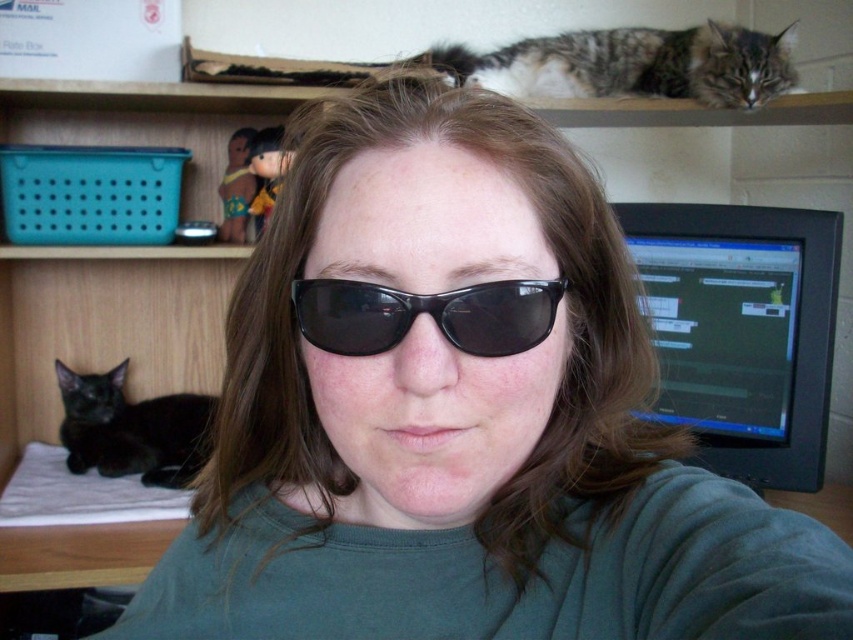
Can you confirm if black plastic sunglasses at center is smaller than black fur cat at lower left?

Indeed, black plastic sunglasses at center has a smaller size compared to black fur cat at lower left.

Who is more distant from viewer, (543, 312) or (67, 448)?

The point (67, 448) is more distant.

You are a GUI agent. You are given a task and a screenshot of the screen. Output one action in this format:
    pyautogui.click(x=<x>, y=<y>)
    Task: Click on the black plastic sunglasses at center
    Image resolution: width=853 pixels, height=640 pixels.
    Given the screenshot: What is the action you would take?
    pyautogui.click(x=425, y=312)

Which of these two, black glossy monitor at right or black plastic sunglasses at center, stands taller?

black glossy monitor at right is taller.

Who is positioned more to the right, black glossy monitor at right or black plastic sunglasses at center?

Positioned to the right is black glossy monitor at right.

This screenshot has height=640, width=853. Find the location of `black glossy monitor at right`. black glossy monitor at right is located at coordinates (741, 332).

In the scene shown: Which is above, tabby fur cat at upper center or black plastic sunglasses at center?

tabby fur cat at upper center

Is tabby fur cat at upper center taller than black plastic sunglasses at center?

Yes, tabby fur cat at upper center is taller than black plastic sunglasses at center.

You are a GUI agent. You are given a task and a screenshot of the screen. Output one action in this format:
    pyautogui.click(x=<x>, y=<y>)
    Task: Click on the tabby fur cat at upper center
    
    Given the screenshot: What is the action you would take?
    pyautogui.click(x=631, y=65)